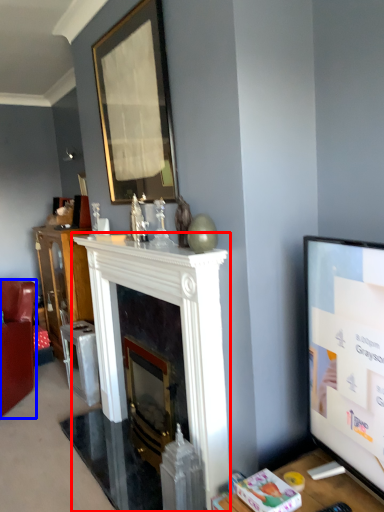
Question: Which point is closer to the camera, fireplace (highlighted by a red box) or chair (highlighted by a blue box)?

Choices:
 (A) fireplace
 (B) chair

Answer: (A)